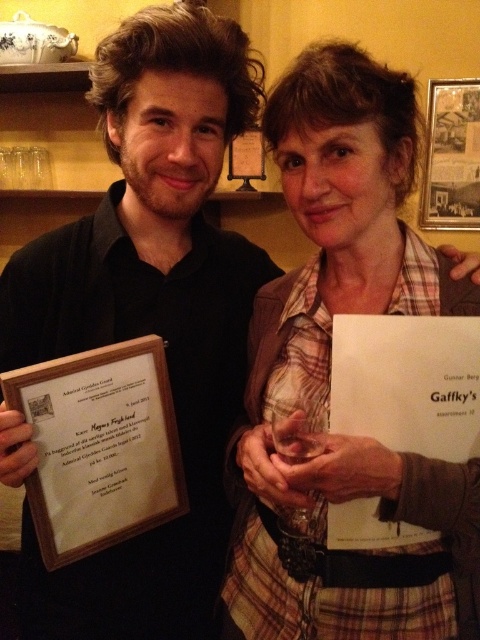
You are standing in the same room as the two people in the image. If you want to hand a document to the person wearing the matte black shirt at center, which direction should you move to approach them?

Since the matte black shirt at center is located at point 0.487 on the x axis and 0.312 on the y axis, you should move towards the center of the room to reach them.

You are a photographer at the event and need to capture a closeup of both the matte black shirt at center and the plaid fabric shirt at center. What is the minimum distance you need to maintain between the camera and the shirts to ensure both are in frame?

The minimum distance required is 20.02 centimeters because the two shirts are 20.02 centimeters apart, so the camera must be positioned far enough to include both in the frame.

You are organizing a photo shoot and need to ensure that the two shirts displayed in the image are visible in the frame. Given that the matte black shirt at center and the plaid fabric shirt at center are both central to the composition, which shirt would require a wider frame to accommodate its full width?

The matte black shirt at center has a greater width than the plaid fabric shirt at center, so it would require a wider frame to fully display its entire width.